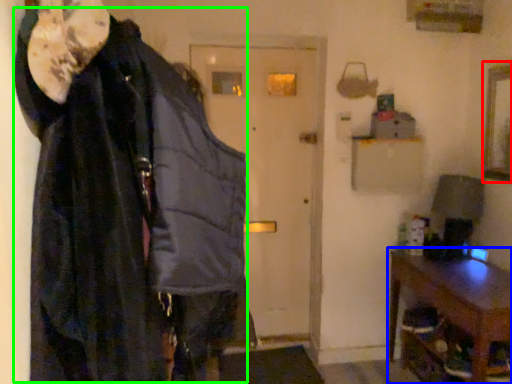
Question: Which object is positioned farthest from picture frame (highlighted by a red box)? Select from furniture (highlighted by a blue box) and cloak (highlighted by a green box).

Choices:
 (A) furniture
 (B) cloak

Answer: (B)